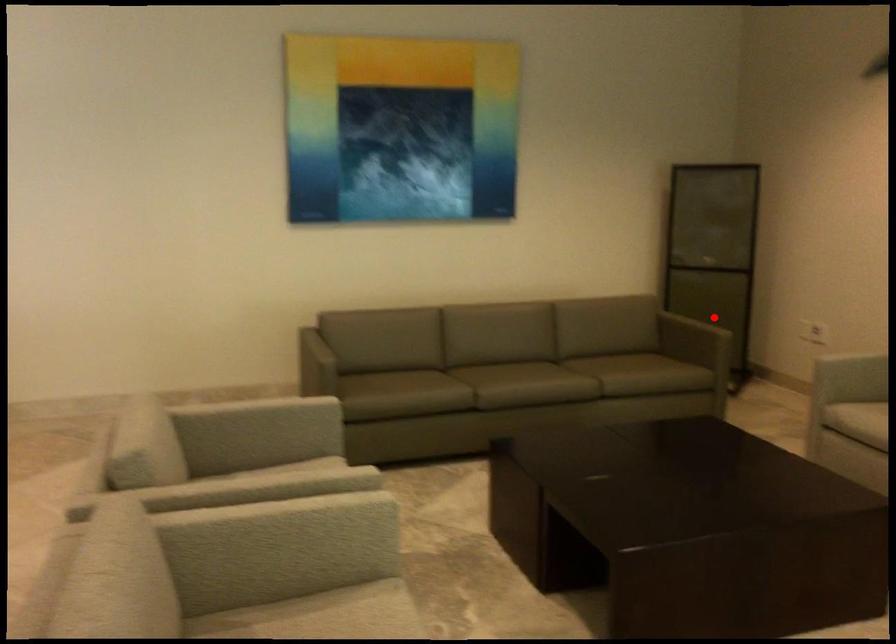
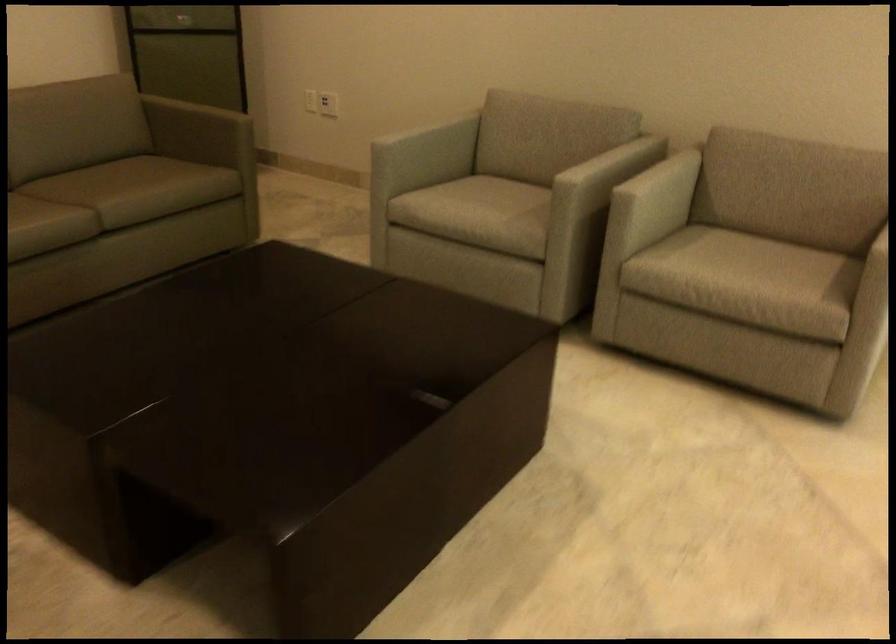
Question: I am providing you with two images of the same scene from different viewpoints. In image1, a red point is highlighted. Considering the same 3D point in image2, which of the following is correct?

Choices:
 (A) It is closer
 (B) It is farther

Answer: (A)